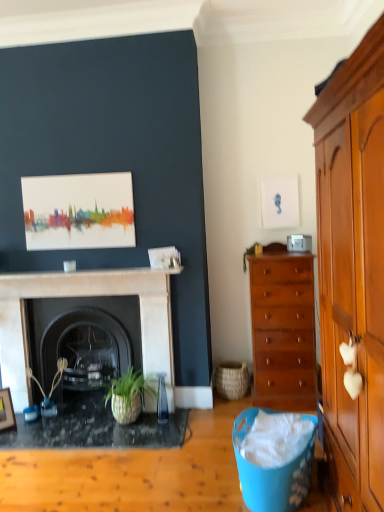
The height and width of the screenshot is (512, 384). Identify the location of vacant area that lies to the right of wooden picture frame at lower left. (23, 420).